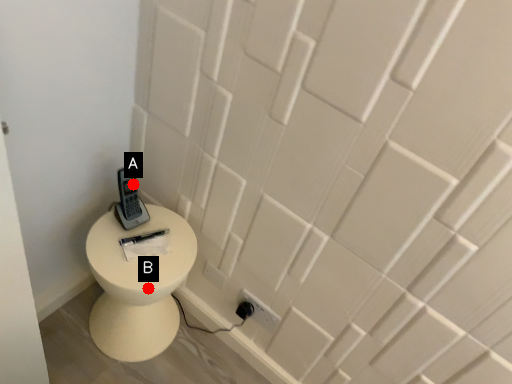
Question: Two points are circled on the image, labeled by A and B beside each circle. Which point appears farthest from the camera in this image?

Choices:
 (A) A is further
 (B) B is further

Answer: (A)